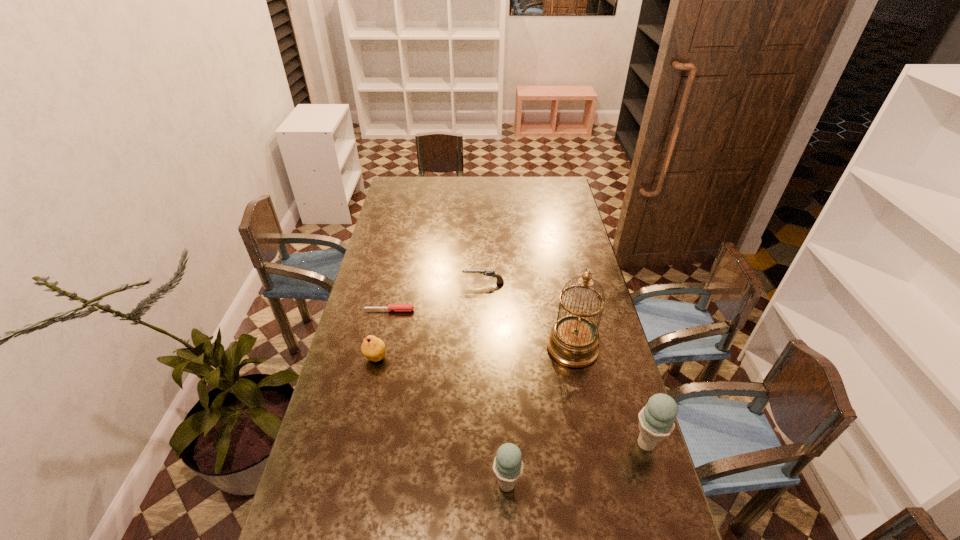
Locate an element on the screen. This screenshot has width=960, height=540. free space between the left ice cream and the tallest object is located at coordinates click(540, 416).

Identify which object is located as the second nearest to the shorter ice cream. Please provide its 2D coordinates. Your answer should be formatted as a tuple, i.e. [(x, y)], where the tuple contains the x and y coordinates of a point satisfying the conditions above.

[(574, 340)]

Identify the location of object identified as the third closest to the gun. The image size is (960, 540). (373, 348).

Find the location of `vacant space that satisfies the following two spatial constraints: 1. on the front side of the right ice cream; 2. on the right side of the pear`. vacant space that satisfies the following two spatial constraints: 1. on the front side of the right ice cream; 2. on the right side of the pear is located at coordinates (356, 444).

You are a GUI agent. You are given a task and a screenshot of the screen. Output one action in this format:
    pyautogui.click(x=<x>, y=<y>)
    Task: Click on the free location that satisfies the following two spatial constraints: 1. with an open door on the fifth object from left to right; 2. on the left side of the fifth farthest object
    The image size is (960, 540).
    Given the screenshot: What is the action you would take?
    (592, 444)

Where is `blank space that satisfies the following two spatial constraints: 1. aiming along the barrel of the gun; 2. on the front side of the pear`? The image size is (960, 540). blank space that satisfies the following two spatial constraints: 1. aiming along the barrel of the gun; 2. on the front side of the pear is located at coordinates (484, 357).

Locate an element on the screen. The image size is (960, 540). vacant space that satisfies the following two spatial constraints: 1. on the front side of the third shortest object; 2. on the right side of the farther ice cream is located at coordinates (356, 444).

Locate an element on the screen. free spot that satisfies the following two spatial constraints: 1. with an open door on the rightmost object; 2. on the right side of the tallest object is located at coordinates (592, 444).